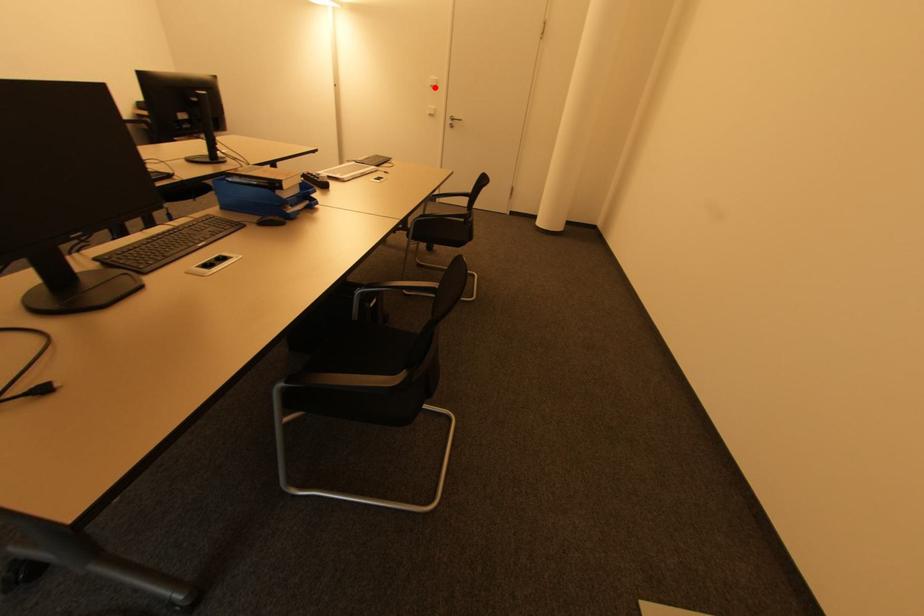
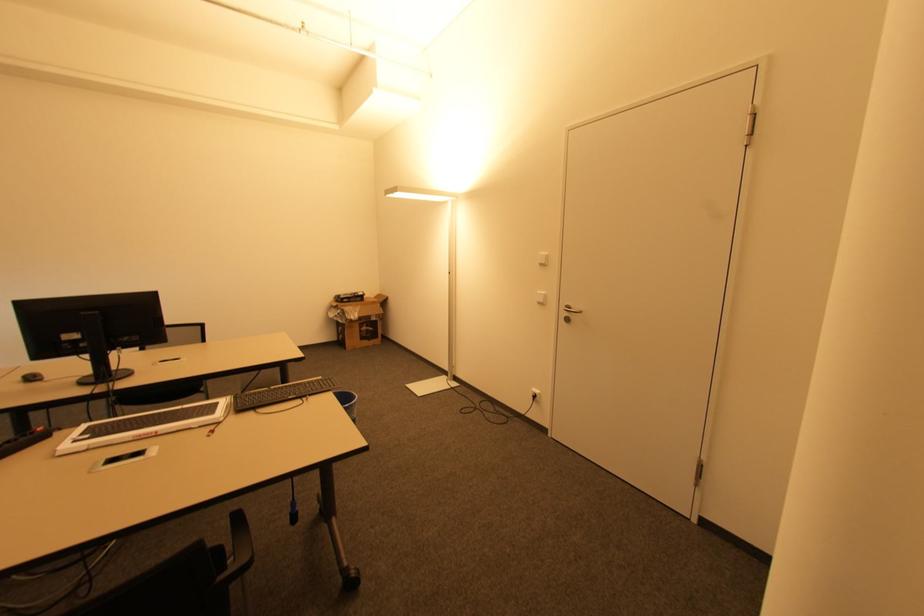
Question: I am providing you with two images of the same scene from different viewpoints. Given a red point in image1, look at the same physical point in image2. Is it:

Choices:
 (A) Closer to the viewpoint
 (B) Farther from the viewpoint

Answer: (B)